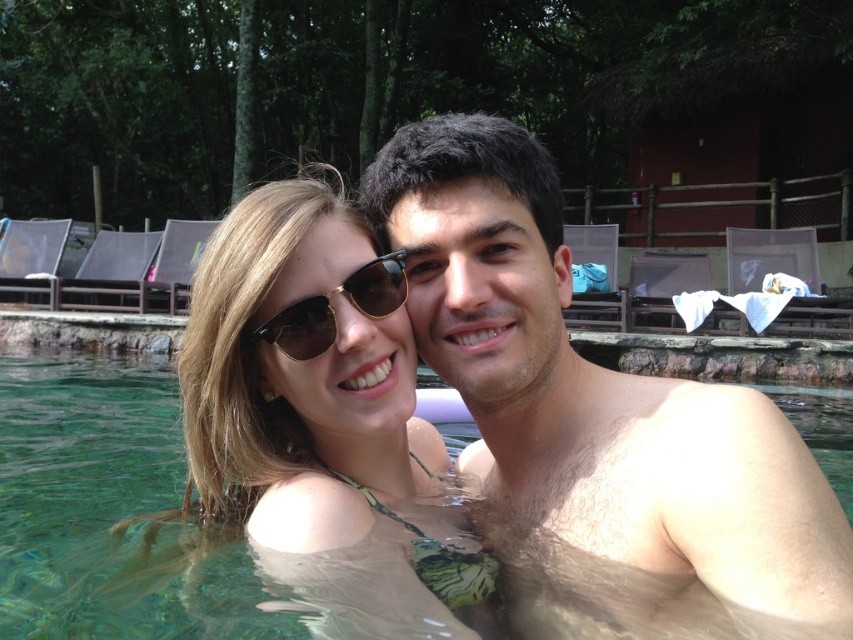
You are a photographer trying to capture the perfect shot of the matte gold sunglasses at center. The pool has a depth of 1.5 meters. If you want to place your camera 1 meter below the water surface, will the sunglasses still be visible from that position?

The matte gold sunglasses at center are located at point (317, 392). Since the pool depth is 1.5 meters and the camera is placed 1 meter below the surface, there is still 0.5 meters of water above the camera. This allows light to travel from the sunglasses to the camera through the water, so yes, the sunglasses will be visible.

From the picture: You are designing a safety sign for the pool area and need to know which object between the clear glass water at center and the matte gold sunglasses at center is narrower. Which one is it?

The clear glass water at center is narrower than the matte gold sunglasses at center, so the clear glass water at center is the narrower object.